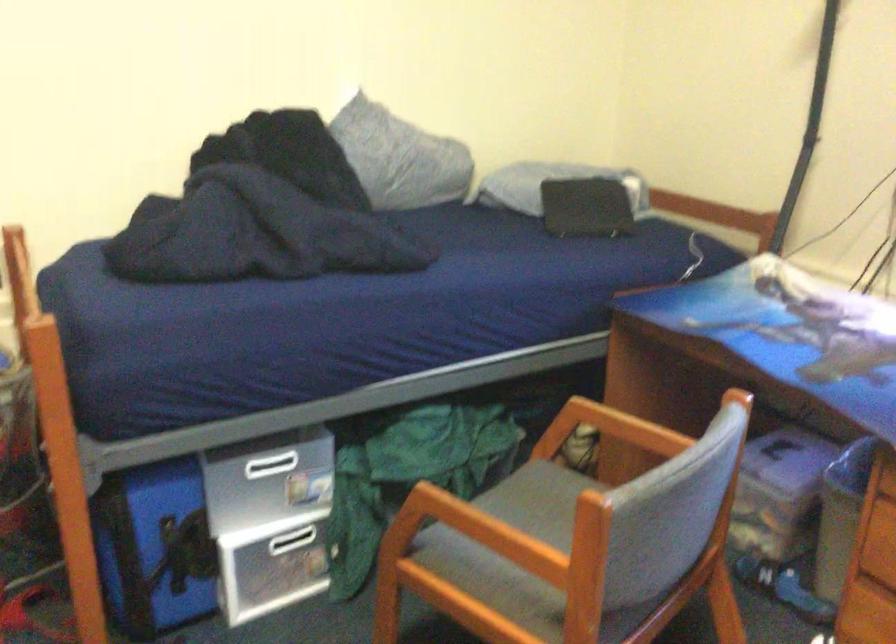
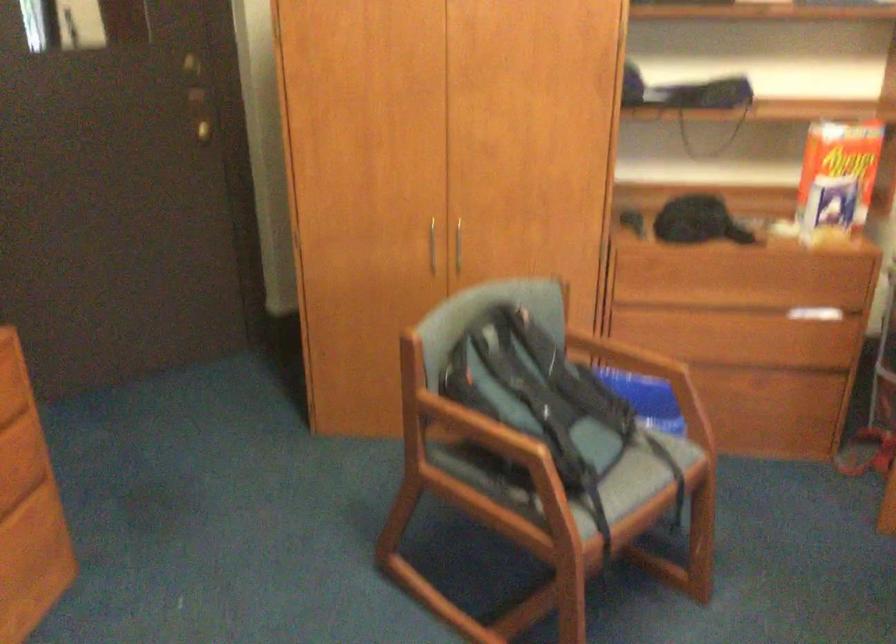
The first image is from the beginning of the video and the second image is from the end. How did the camera likely rotate when shooting the video?

The camera's rotation is toward left-down.